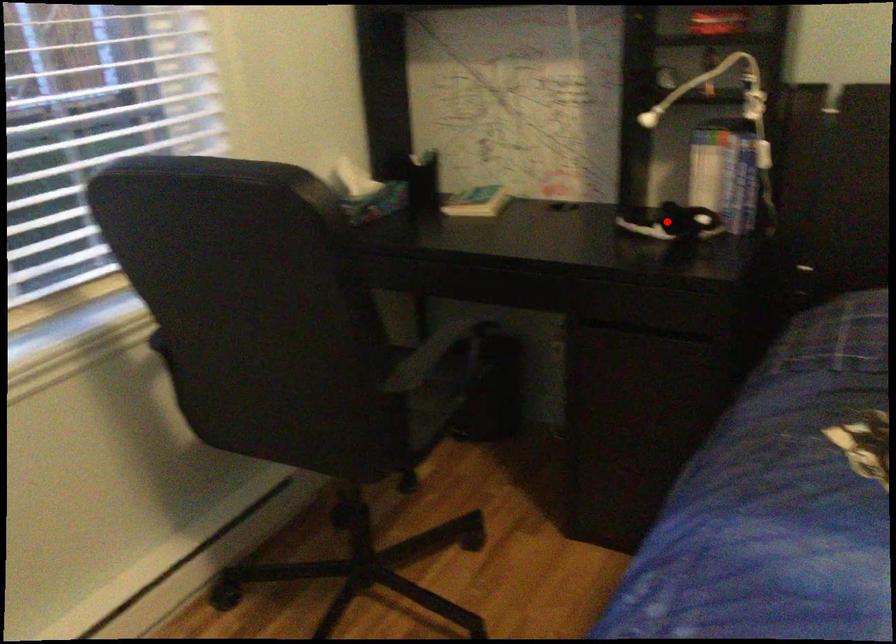
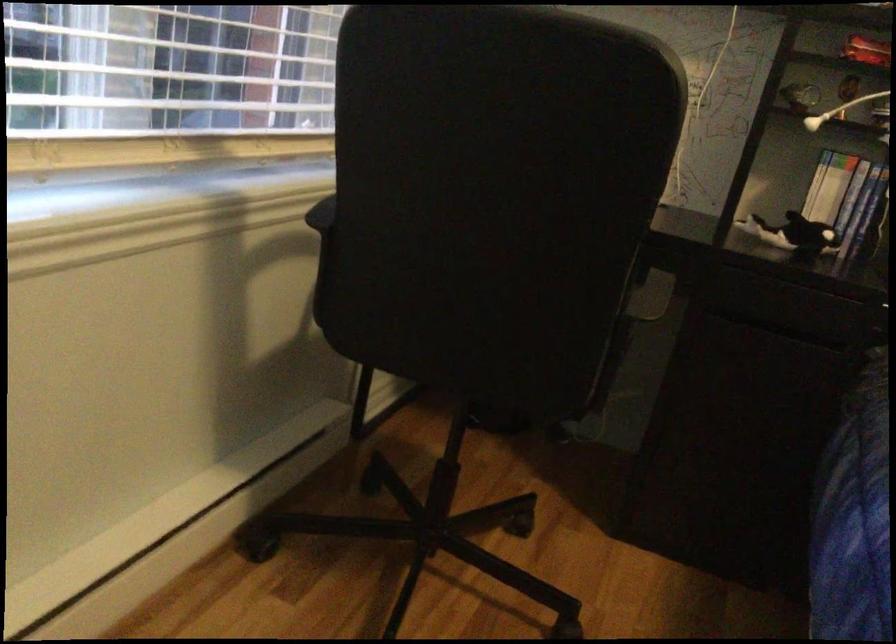
Find the pixel in the second image that matches the highlighted location in the first image.

(793, 234)